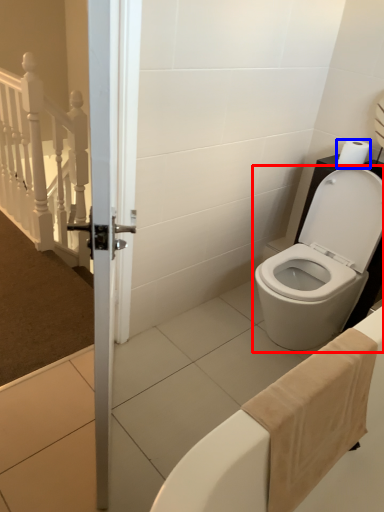
Question: Which point is further to the camera, toilet (highlighted by a red box) or toilet paper (highlighted by a blue box)?

Choices:
 (A) toilet
 (B) toilet paper

Answer: (B)